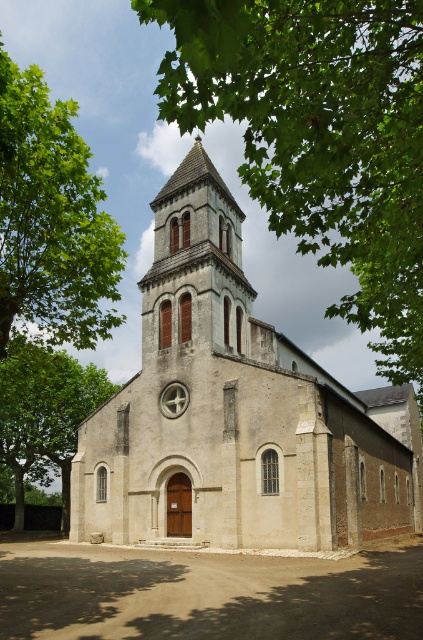
Question: From the image, what is the correct spatial relationship of green leafy tree at upper center in relation to green leafy tree at left?

Choices:
 (A) above
 (B) below

Answer: (A)

Question: From the image, what is the correct spatial relationship of green leafy tree at left in relation to smooth stone spire at center?

Choices:
 (A) below
 (B) above

Answer: (A)

Question: Which point appears closest to the camera in this image?

Choices:
 (A) (25, 93)
 (B) (79, 509)

Answer: (A)

Question: Considering the relative positions of green leafy tree at upper center and green leafy tree at left in the image provided, where is green leafy tree at upper center located with respect to green leafy tree at left?

Choices:
 (A) left
 (B) right

Answer: (B)

Question: Which of the following is the farthest from the observer?

Choices:
 (A) (247, 461)
 (B) (47, 237)

Answer: (A)

Question: Estimate the real-world distances between objects in this image. Which object is closer to the green leafy tree at left?

Choices:
 (A) green leafy tree at lower left
 (B) green leafy tree at upper center

Answer: (A)